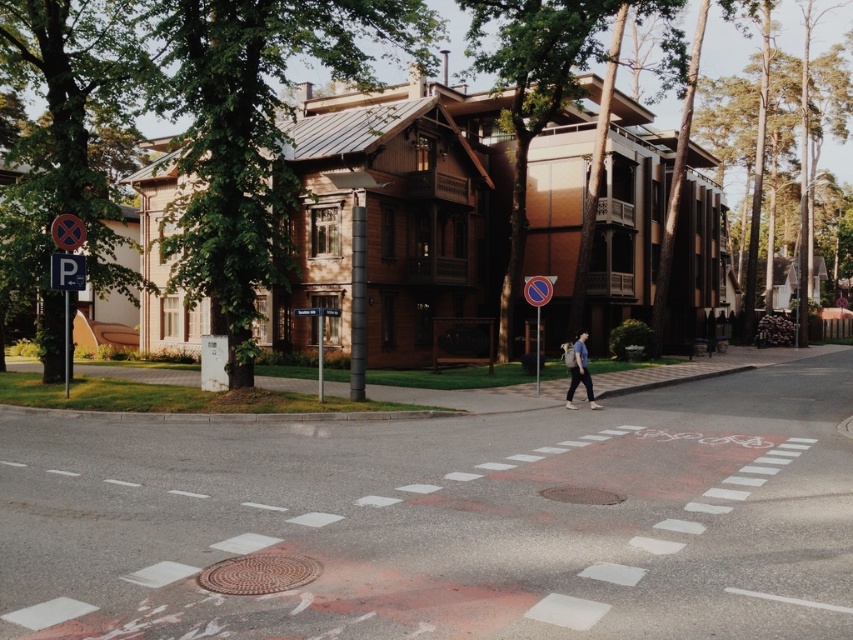
Question: Which object is closer to the camera taking this photo?

Choices:
 (A) green leafy tree at left
 (B) green leafy tree at center
 (C) metallic reflective no parking sign at center

Answer: (B)

Question: Which point appears farthest from the camera in this image?

Choices:
 (A) (178, 260)
 (B) (82, 4)

Answer: (B)

Question: Can you confirm if blue cotton shirt at center is bigger than metallic reflective no parking sign at center?

Choices:
 (A) yes
 (B) no

Answer: (B)

Question: Is green leafy tree at left to the left of brown wood tree at upper left from the viewer's perspective?

Choices:
 (A) yes
 (B) no

Answer: (A)

Question: Which point appears farthest from the camera in this image?

Choices:
 (A) (585, 369)
 (B) (543, 292)

Answer: (B)

Question: Is green leafy tree at left positioned in front of blue cotton shirt at center?

Choices:
 (A) no
 (B) yes

Answer: (B)